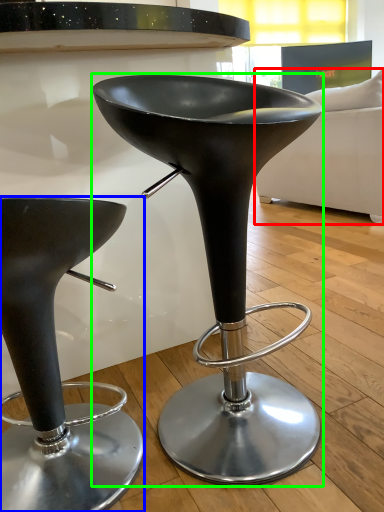
Question: Which is nearer to the couch (highlighted by a red box)? stool (highlighted by a blue box) or stool (highlighted by a green box).

Choices:
 (A) stool
 (B) stool

Answer: (B)